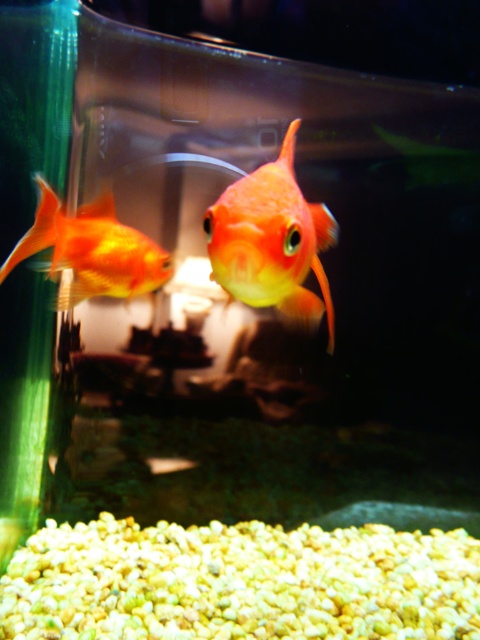
Between shiny orange goldfish at center and matte orange goldfish at left, which one has more height?

With more height is shiny orange goldfish at center.

Locate an element on the screen. Image resolution: width=480 pixels, height=640 pixels. shiny orange goldfish at center is located at coordinates (272, 241).

Is point (226, 202) more distant than point (27, 236)?

No, it is in front of (27, 236).

Identify the location of shiny orange goldfish at center. Image resolution: width=480 pixels, height=640 pixels. (272, 241).